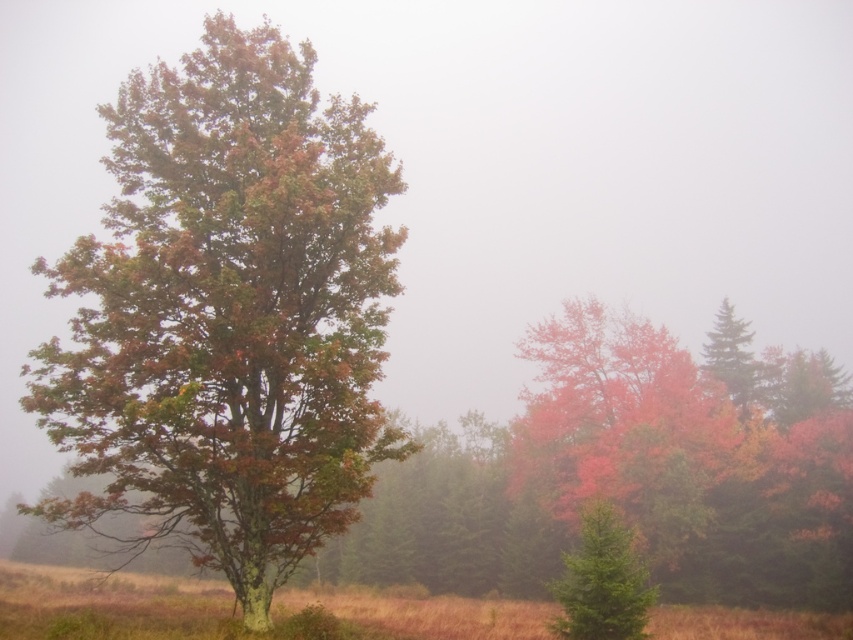
Is point (161, 298) in front of point (614, 630)?

No, it is not.

Does point (235, 49) lie in front of point (606, 625)?

That is False.

The width and height of the screenshot is (853, 640). I want to click on multicolored foliage tree at left, so click(x=228, y=314).

Does green matte evergreen at lower right have a lesser height compared to green matte tree at upper right?

Indeed, green matte evergreen at lower right has a lesser height compared to green matte tree at upper right.

Who is lower down, green matte evergreen at lower right or green matte tree at upper right?

green matte evergreen at lower right is below.

Between point (587, 520) and point (721, 346), which one is positioned behind?

The point (721, 346) is behind.

Image resolution: width=853 pixels, height=640 pixels. I want to click on green matte evergreen at lower right, so click(x=602, y=580).

Image resolution: width=853 pixels, height=640 pixels. Describe the element at coordinates (228, 314) in the screenshot. I see `multicolored foliage tree at left` at that location.

Does multicolored foliage tree at left appear on the left side of green matte tree at upper right?

Correct, you'll find multicolored foliage tree at left to the left of green matte tree at upper right.

Is point (329, 285) farther from camera compared to point (746, 412)?

No, (329, 285) is in front of (746, 412).

Image resolution: width=853 pixels, height=640 pixels. Identify the location of multicolored foliage tree at left. (228, 314).